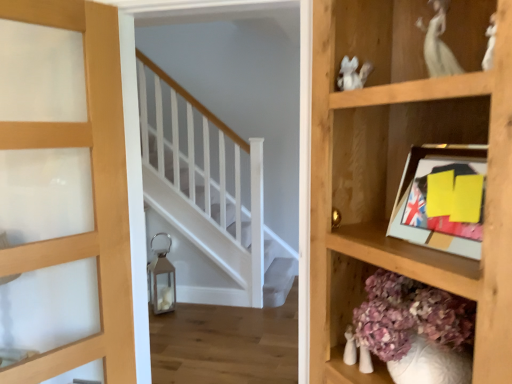
Question: From a real-world perspective, is wooden shelf at right below yellow paper picture frame at upper right?

Choices:
 (A) no
 (B) yes

Answer: (B)

Question: Is wooden shelf at right facing away from yellow paper picture frame at upper right?

Choices:
 (A) yes
 (B) no

Answer: (A)

Question: Does wooden shelf at right have a lesser height compared to yellow paper picture frame at upper right?

Choices:
 (A) no
 (B) yes

Answer: (A)

Question: Is wooden shelf at right in contact with yellow paper picture frame at upper right?

Choices:
 (A) no
 (B) yes

Answer: (A)

Question: Does wooden shelf at right appear on the right side of yellow paper picture frame at upper right?

Choices:
 (A) no
 (B) yes

Answer: (B)

Question: From the image's perspective, does wooden shelf at right appear lower than yellow paper picture frame at upper right?

Choices:
 (A) no
 (B) yes

Answer: (B)

Question: Is yellow paper picture frame at upper right further to the viewer compared to matte wood door at left?

Choices:
 (A) yes
 (B) no

Answer: (B)

Question: Is matte wood door at left located within yellow paper picture frame at upper right?

Choices:
 (A) yes
 (B) no

Answer: (B)

Question: Is yellow paper picture frame at upper right taller than matte wood door at left?

Choices:
 (A) yes
 (B) no

Answer: (B)

Question: Is yellow paper picture frame at upper right shorter than matte wood door at left?

Choices:
 (A) no
 (B) yes

Answer: (B)

Question: From the image's perspective, does yellow paper picture frame at upper right appear lower than matte wood door at left?

Choices:
 (A) no
 (B) yes

Answer: (A)

Question: From a real-world perspective, is yellow paper picture frame at upper right on top of matte wood door at left?

Choices:
 (A) yes
 (B) no

Answer: (A)

Question: Are matte wood door at left and yellow paper picture frame at upper right far apart?

Choices:
 (A) no
 (B) yes

Answer: (B)